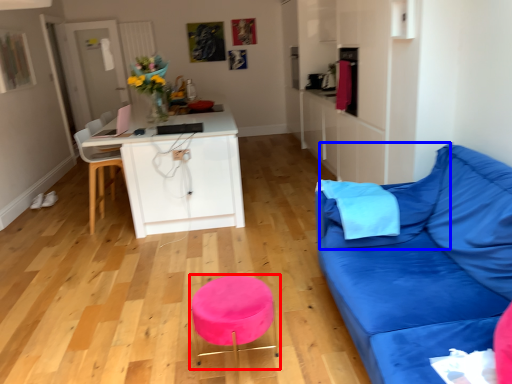
Question: Which object is closer to the camera taking this photo, bar stool (highlighted by a red box) or pillow (highlighted by a blue box)?

Choices:
 (A) bar stool
 (B) pillow

Answer: (A)